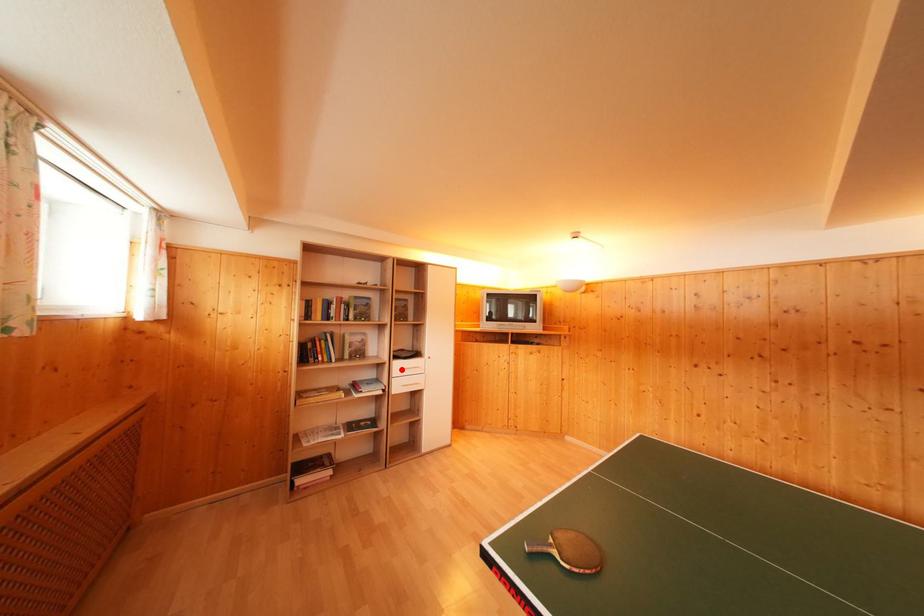
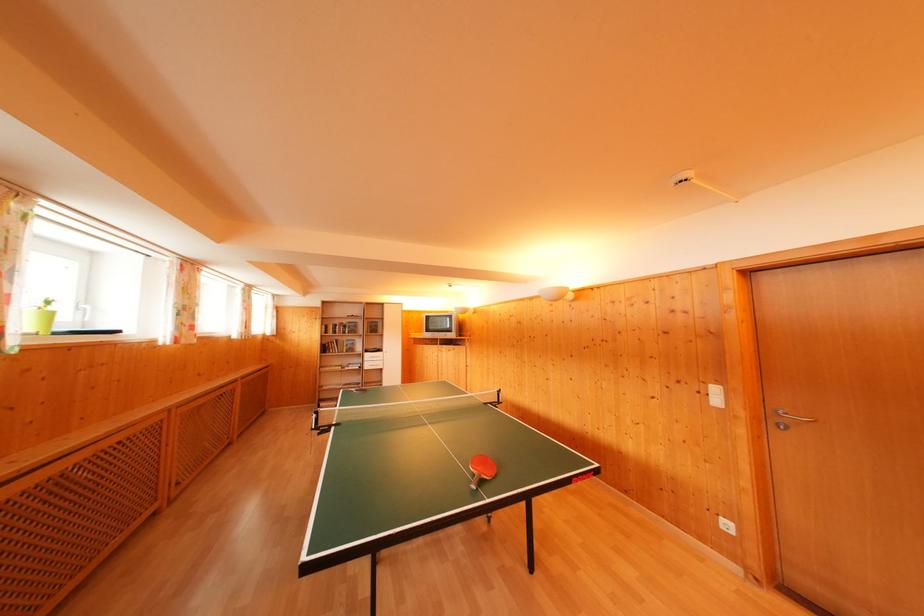
Find the pixel in the second image that matches the highlighted location in the first image.

(371, 360)